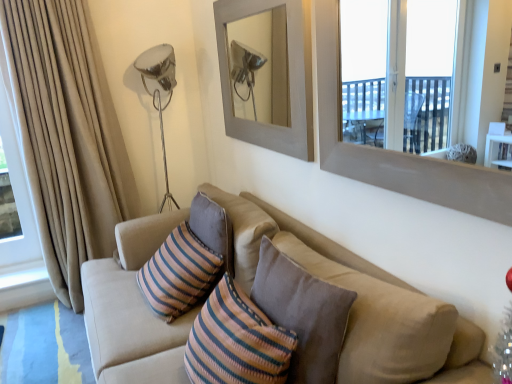
Question: Does gray matte picture frame at upper center have a lesser width compared to beige fabric couch at center?

Choices:
 (A) yes
 (B) no

Answer: (A)

Question: Would you say gray matte picture frame at upper center is outside beige fabric couch at center?

Choices:
 (A) no
 (B) yes

Answer: (B)

Question: Can you see gray matte picture frame at upper center touching beige fabric couch at center?

Choices:
 (A) no
 (B) yes

Answer: (A)

Question: Is the position of gray matte picture frame at upper center less distant than that of beige fabric couch at center?

Choices:
 (A) yes
 (B) no

Answer: (B)

Question: Is beige fabric couch at center located within gray matte picture frame at upper center?

Choices:
 (A) no
 (B) yes

Answer: (A)

Question: Is gray matte picture frame at upper center taller than beige fabric couch at center?

Choices:
 (A) yes
 (B) no

Answer: (B)

Question: Can you confirm if gray matte picture frame at upper center is positioned to the left of smooth gray window frame at upper right?

Choices:
 (A) yes
 (B) no

Answer: (A)

Question: Considering the relative sizes of gray matte picture frame at upper center and smooth gray window frame at upper right in the image provided, is gray matte picture frame at upper center smaller than smooth gray window frame at upper right?

Choices:
 (A) yes
 (B) no

Answer: (A)

Question: Does gray matte picture frame at upper center appear on the right side of smooth gray window frame at upper right?

Choices:
 (A) yes
 (B) no

Answer: (B)

Question: Does gray matte picture frame at upper center touch smooth gray window frame at upper right?

Choices:
 (A) yes
 (B) no

Answer: (B)

Question: Does gray matte picture frame at upper center have a lesser width compared to smooth gray window frame at upper right?

Choices:
 (A) yes
 (B) no

Answer: (A)

Question: Is gray matte picture frame at upper center not inside smooth gray window frame at upper right?

Choices:
 (A) no
 (B) yes

Answer: (B)

Question: From a real-world perspective, is beige fabric curtain at left on gray matte picture frame at upper center?

Choices:
 (A) no
 (B) yes

Answer: (A)